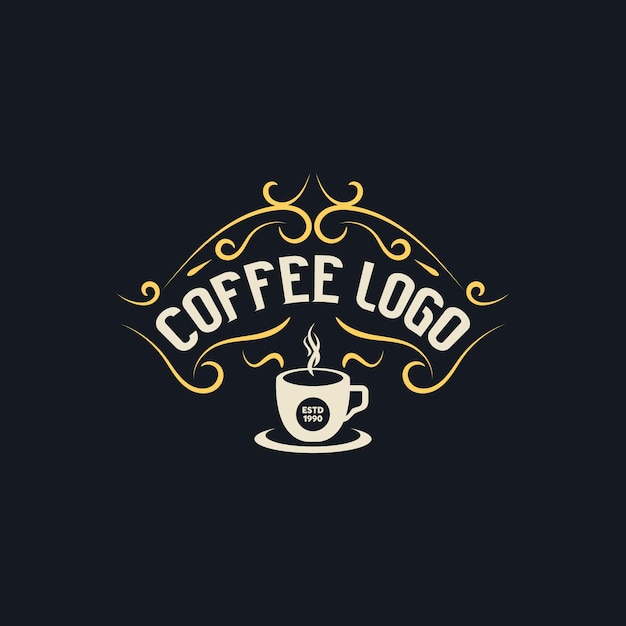
You are a GUI agent. You are given a task and a screenshot of the screen. Output one action in this format:
    pyautogui.click(x=<x>, y=<y>)
    Task: Click on the white plate line under cup
    The width and height of the screenshot is (626, 626).
    Given the screenshot: What is the action you would take?
    pyautogui.click(x=357, y=444), pyautogui.click(x=275, y=451)